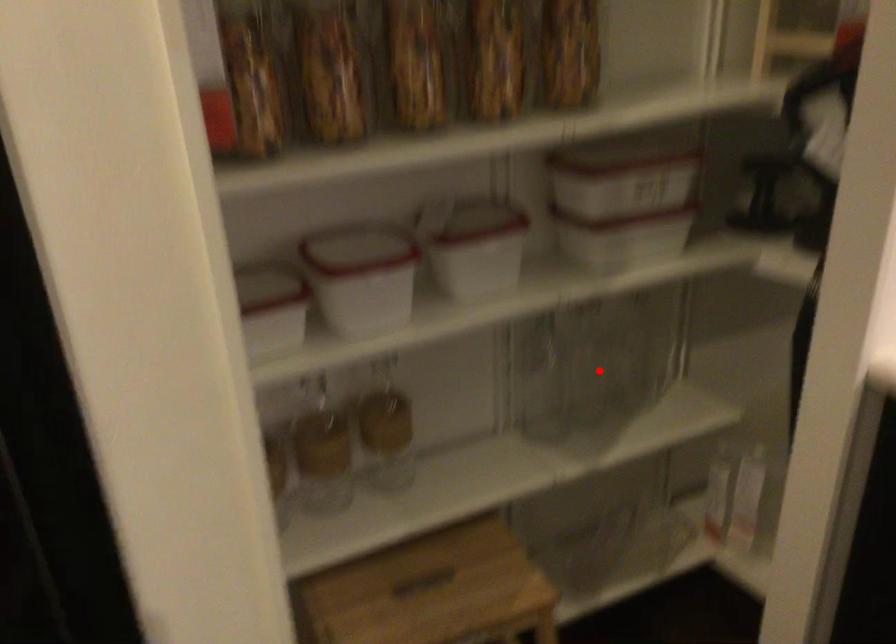
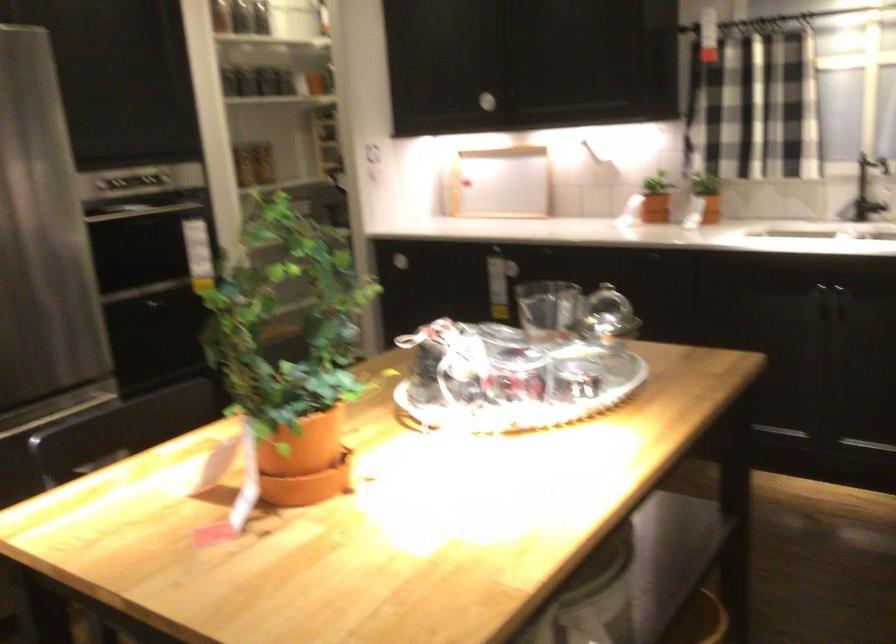
Question: I am providing you with two images of the same scene from different viewpoints. A red point is marked on the first image. Can you still see the location of the red point in image 2?

Choices:
 (A) Yes
 (B) No

Answer: (B)